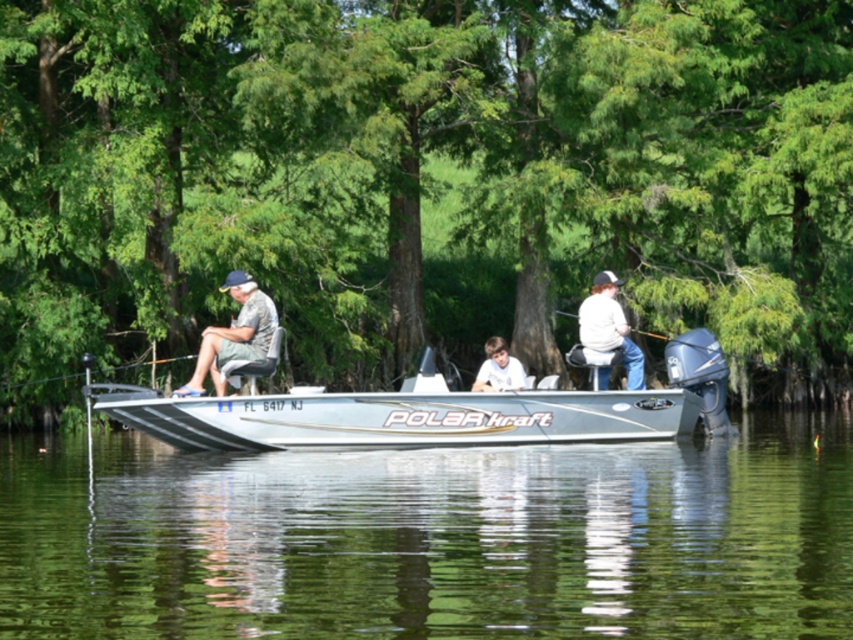
Between silver metallic boat at center and white matte shirt at center, which one has more height?

silver metallic boat at center

Can you confirm if silver metallic boat at center is thinner than white matte shirt at center?

In fact, silver metallic boat at center might be wider than white matte shirt at center.

Does point (126, 422) come in front of point (521, 369)?

Yes.

Identify the location of silver metallic boat at center. (430, 412).

Does green leafy tree at center appear over white matte jacket at center?

Yes, green leafy tree at center is above white matte jacket at center.

The image size is (853, 640). I want to click on green leafy tree at center, so pos(422,184).

This screenshot has height=640, width=853. I want to click on green leafy tree at center, so click(422, 184).

At what (x,y) coordinates should I click in order to perform the action: click on green leafy tree at center. Please return your answer as a coordinate pair (x, y). The width and height of the screenshot is (853, 640). Looking at the image, I should click on (422, 184).

Can you confirm if white matte jacket at center is smaller than white matte shirt at center?

No.

Does white matte jacket at center have a larger size compared to white matte shirt at center?

Yes, white matte jacket at center is bigger than white matte shirt at center.

Is point (627, 324) less distant than point (503, 348)?

No, it is not.

Locate an element on the screen. This screenshot has width=853, height=640. white matte jacket at center is located at coordinates (608, 326).